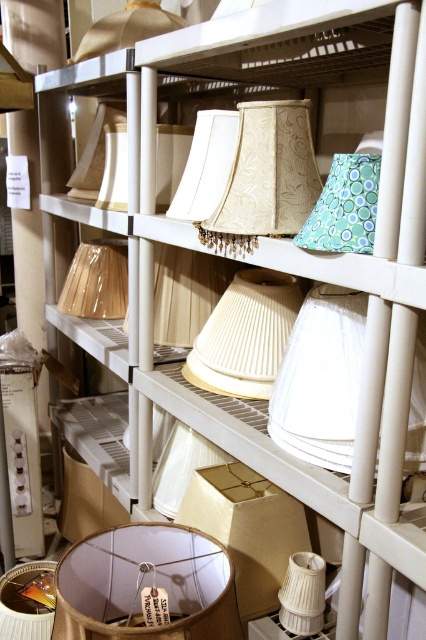
You are organizing the storage area and need to place the beige fabric lampshade at center and the matte beige lampshade at center on the same shelf. Which lampshade requires a wider space on the shelf?

The matte beige lampshade at center requires a wider space on the shelf because its width is greater than the beige fabric lampshade at center.

Consider the image. You are a delivery person who needs to place a new lampshade that is 1.2 meters in diameter into the storage area. Looking at the image, can you determine if there is enough space between the beige pleated lampshade at center and the matte beige lampshade at upper left to fit the new lampshade?

The distance between the beige pleated lampshade at center and the matte beige lampshade at upper left is 1.03 meters. Since the new lampshade is 1.2 meters in diameter, which is larger than the available space, it will not fit between them.